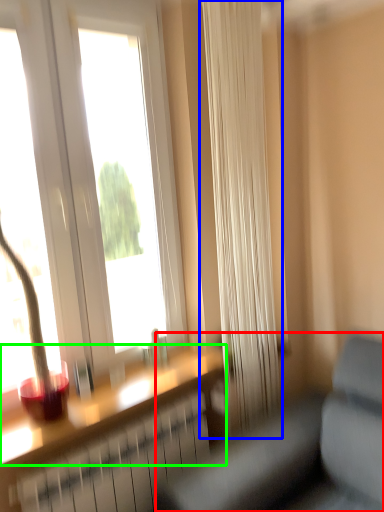
Question: Which object is positioned closest to studio couch (highlighted by a red box)? Select from curtain (highlighted by a blue box) and window sill (highlighted by a green box).

Choices:
 (A) curtain
 (B) window sill

Answer: (B)